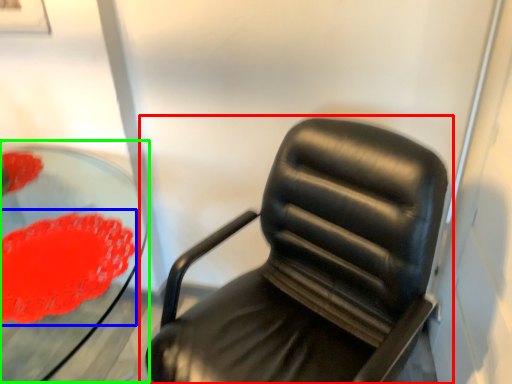
Question: Which object is the closest to the chair (highlighted by a red box)? Choose among these: flower (highlighted by a blue box) or round table (highlighted by a green box).

Choices:
 (A) flower
 (B) round table

Answer: (A)